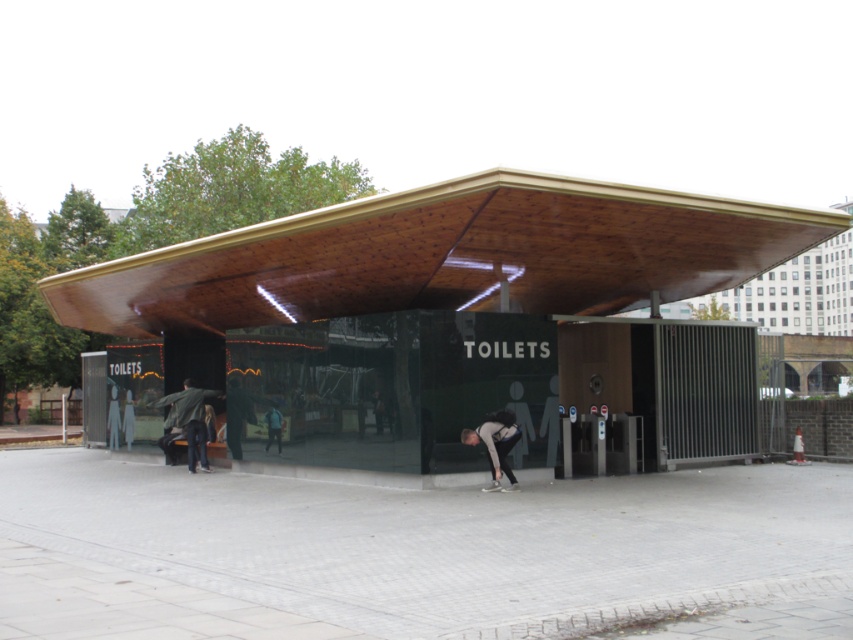
Does point (546, 372) come farther from viewer compared to point (238, 410)?

No.

Does wooden canopy at center have a larger size compared to dark gray jacket at center?

Correct, wooden canopy at center is larger in size than dark gray jacket at center.

This screenshot has height=640, width=853. I want to click on wooden canopy at center, so click(x=463, y=316).

How far apart are green fabric jacket at lower left and dark gray jacket at center?

36.87 inches

Does point (169, 403) come in front of point (225, 433)?

No, (169, 403) is further to viewer.

Locate an element on the screen. green fabric jacket at lower left is located at coordinates (190, 419).

Who is shorter, wooden canopy at center or blue shirt at lower center?

Standing shorter between the two is blue shirt at lower center.

Is the position of wooden canopy at center more distant than that of blue shirt at lower center?

That is False.

What do you see at coordinates (463, 316) in the screenshot? This screenshot has height=640, width=853. I see `wooden canopy at center` at bounding box center [463, 316].

I want to click on wooden canopy at center, so click(463, 316).